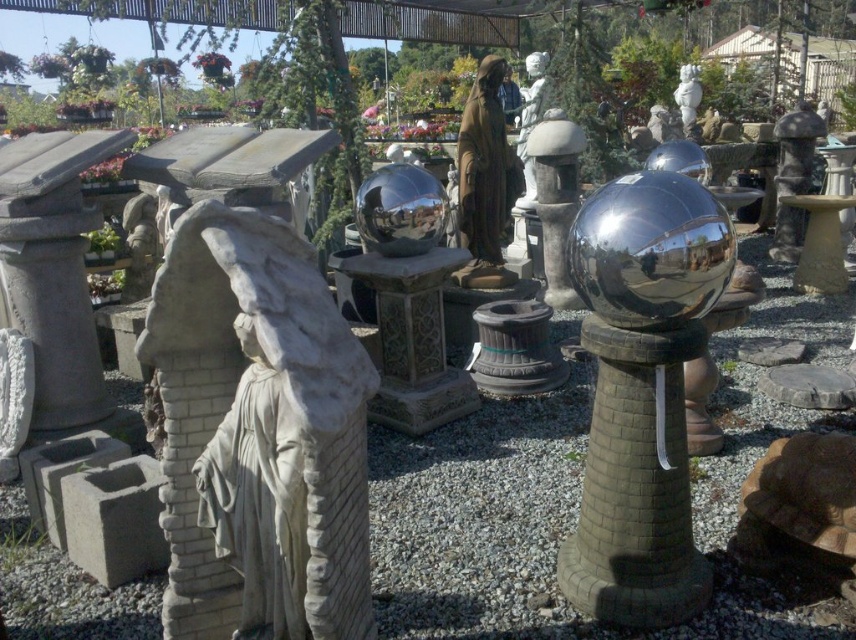
Where is `brown matte statue at center`? brown matte statue at center is located at coordinates (485, 180).

Who is higher up, brown matte statue at center or glossy white statue at center?

glossy white statue at center is above.

This screenshot has height=640, width=856. What are the coordinates of `brown matte statue at center` in the screenshot? It's located at 485,180.

Where is `brown matte statue at center`? Image resolution: width=856 pixels, height=640 pixels. brown matte statue at center is located at coordinates (485, 180).

Can you confirm if white stone statue at left is smaller than brown matte statue at center?

Indeed, white stone statue at left has a smaller size compared to brown matte statue at center.

Is point (214, 484) behind point (471, 88)?

No, (214, 484) is in front of (471, 88).

Which is in front, point (209, 636) or point (510, 276)?

Point (209, 636)

Where is `white stone statue at left`? Image resolution: width=856 pixels, height=640 pixels. white stone statue at left is located at coordinates (260, 428).

Does white stone statue at left have a lesser width compared to glossy white statue at center?

In fact, white stone statue at left might be wider than glossy white statue at center.

Is point (158, 320) positioned before point (676, 93)?

That is True.

Where is `white stone statue at left`? The image size is (856, 640). white stone statue at left is located at coordinates (260, 428).

I want to click on white stone statue at left, so click(260, 428).